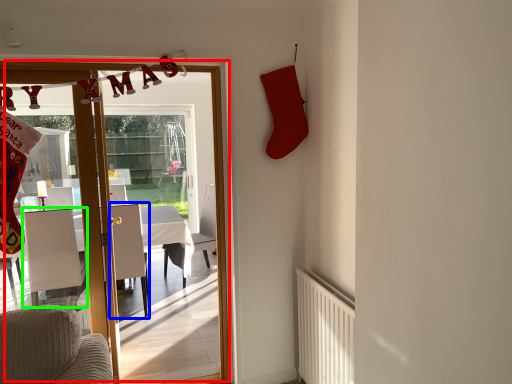
Question: Which is nearer to the door (highlighted by a red box)? armchair (highlighted by a blue box) or armchair (highlighted by a green box).

Choices:
 (A) armchair
 (B) armchair

Answer: (A)